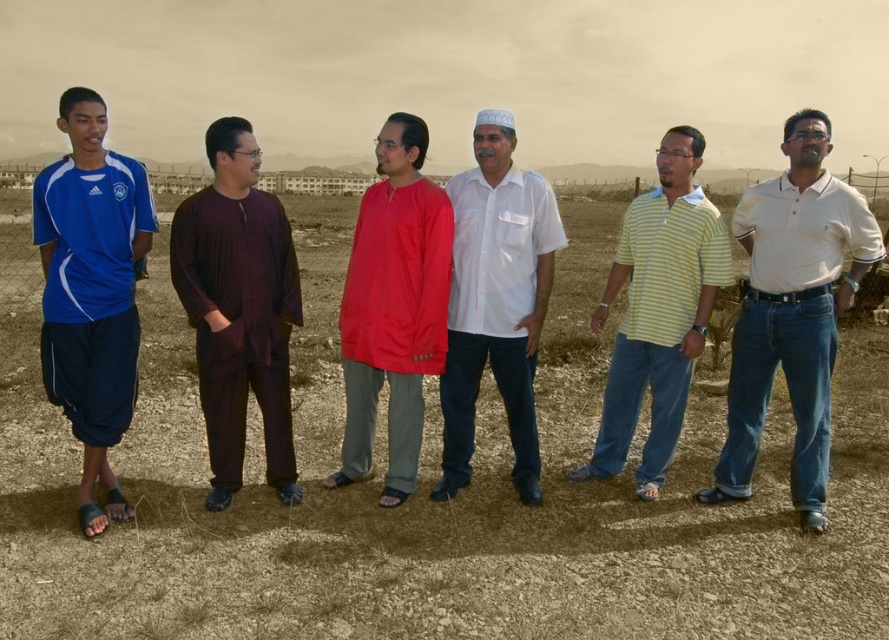
Is white cotton polo shirt at center shorter than white cotton shirt at center?

Correct, white cotton polo shirt at center is not as tall as white cotton shirt at center.

Is white cotton polo shirt at center bigger than white cotton shirt at center?

Correct, white cotton polo shirt at center is larger in size than white cotton shirt at center.

What do you see at coordinates (791, 312) in the screenshot? The image size is (889, 640). I see `white cotton polo shirt at center` at bounding box center [791, 312].

You are a GUI agent. You are given a task and a screenshot of the screen. Output one action in this format:
    pyautogui.click(x=<x>, y=<y>)
    Task: Click on the white cotton polo shirt at center
    
    Given the screenshot: What is the action you would take?
    pyautogui.click(x=791, y=312)

Does point (349, 291) come in front of point (629, 243)?

Yes, it is in front of point (629, 243).

This screenshot has width=889, height=640. What are the coordinates of `matte red shirt at center` in the screenshot? It's located at (393, 307).

Does dark maroon fabric shirt at center have a greater height compared to yellow striped polo shirt at center?

Yes, dark maroon fabric shirt at center is taller than yellow striped polo shirt at center.

Consider the image. Who is shorter, dark maroon fabric shirt at center or yellow striped polo shirt at center?

yellow striped polo shirt at center

Is point (263, 260) in front of point (678, 353)?

Yes, it is.

The width and height of the screenshot is (889, 640). Find the location of `dark maroon fabric shirt at center`. dark maroon fabric shirt at center is located at coordinates (238, 308).